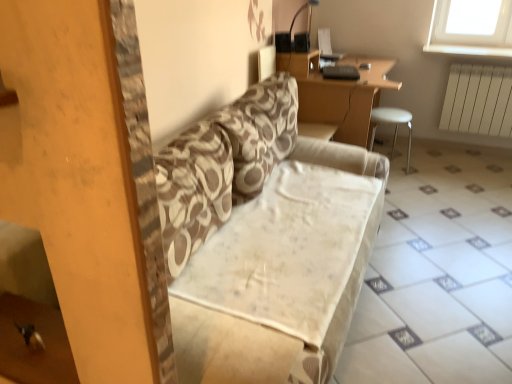
The height and width of the screenshot is (384, 512). Identify the location of vacant area on top of white plastic radiator at right (from a real-world perspective). (490, 66).